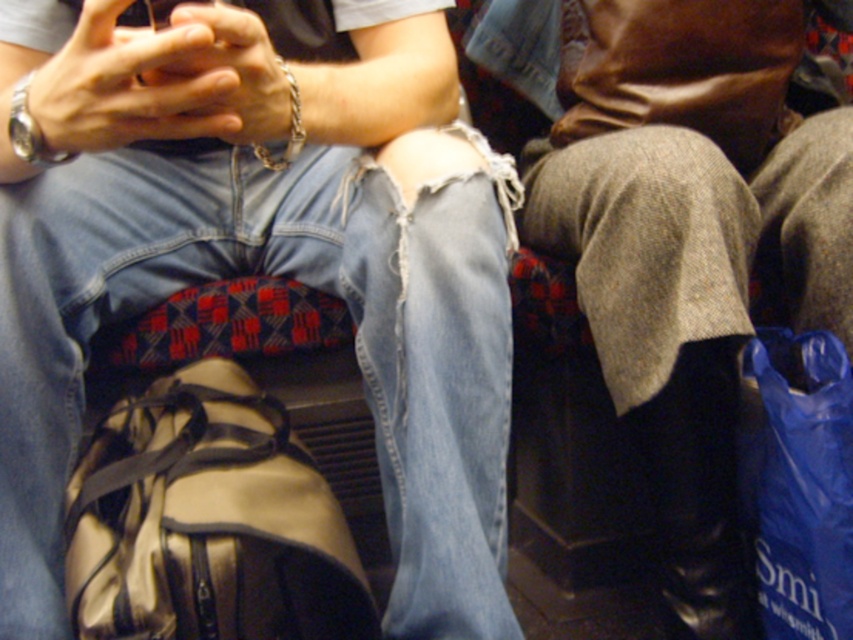
Question: Which point is closer to the camera?

Choices:
 (A) denim jeans at center
 (B) blue plastic bag at lower right
 (C) shiny metallic bag at center

Answer: (A)

Question: Which of these objects is positioned closest to the blue plastic bag at lower right?

Choices:
 (A) shiny metallic bag at center
 (B) denim jeans at center

Answer: (B)

Question: Does denim jeans at center lie in front of blue plastic bag at lower right?

Choices:
 (A) no
 (B) yes

Answer: (B)

Question: Where is denim jeans at center located in relation to shiny metallic bag at center in the image?

Choices:
 (A) below
 (B) above

Answer: (B)

Question: Considering the relative positions of denim jeans at center and shiny metallic bag at center in the image provided, where is denim jeans at center located with respect to shiny metallic bag at center?

Choices:
 (A) left
 (B) right

Answer: (B)

Question: Which object appears closest to the camera in this image?

Choices:
 (A) shiny metallic bag at center
 (B) denim jeans at center

Answer: (B)